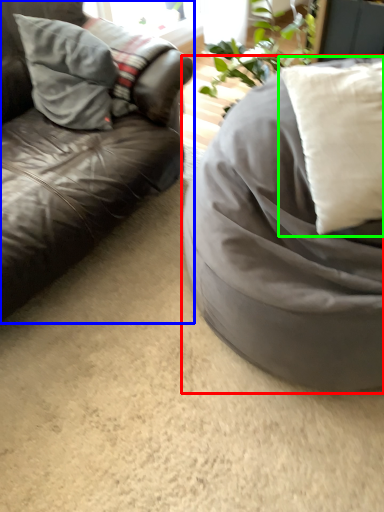
Question: Which is nearer to the furniture (highlighted by a red box)? studio couch (highlighted by a blue box) or pillow (highlighted by a green box).

Choices:
 (A) studio couch
 (B) pillow

Answer: (B)